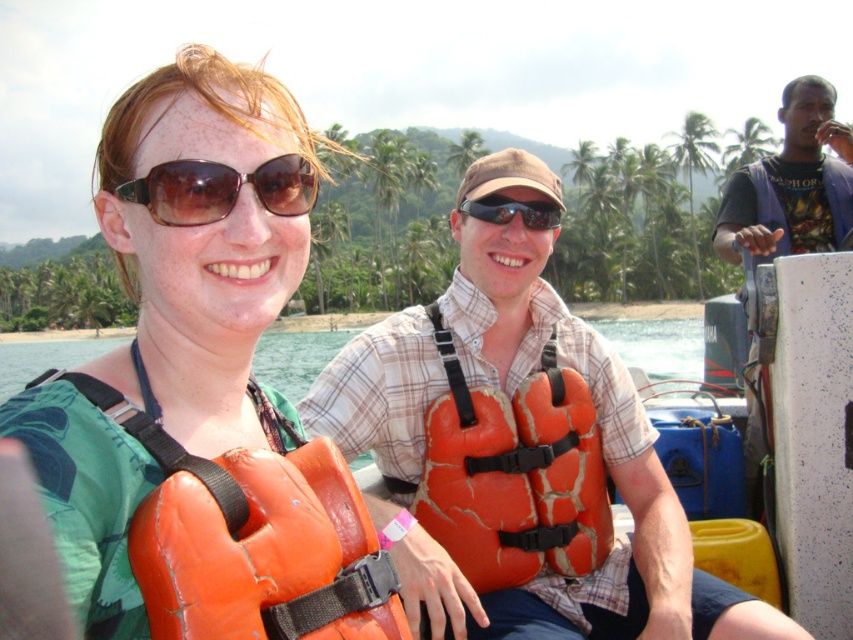
Between point (347, 556) and point (276, 365), which one is positioned behind?

Positioned behind is point (276, 365).

Can you confirm if orange matte life jacket at left is positioned above orange life vest at center?

Correct, orange matte life jacket at left is located above orange life vest at center.

Between point (337, 593) and point (634, 355), which one is positioned behind?

Point (634, 355)

The height and width of the screenshot is (640, 853). Find the location of `orange matte life jacket at left`. orange matte life jacket at left is located at coordinates (265, 554).

Between dark blue fabric shirt at right and orange life vest at center, which one appears on the right side from the viewer's perspective?

Positioned to the right is dark blue fabric shirt at right.

Consider the image. Does dark blue fabric shirt at right come behind orange life vest at center?

No, it is not.

Between point (788, 196) and point (45, 348), which one is positioned behind?

Point (45, 348)

The height and width of the screenshot is (640, 853). Find the location of `dark blue fabric shirt at right`. dark blue fabric shirt at right is located at coordinates pos(791,182).

Which is more to the left, orange matte life jacket at left or dark blue fabric shirt at right?

From the viewer's perspective, orange matte life jacket at left appears more on the left side.

In the scene shown: Does orange matte life jacket at left lie in front of dark blue fabric shirt at right?

Yes, it is.

This screenshot has width=853, height=640. I want to click on orange matte life jacket at left, so click(x=265, y=554).